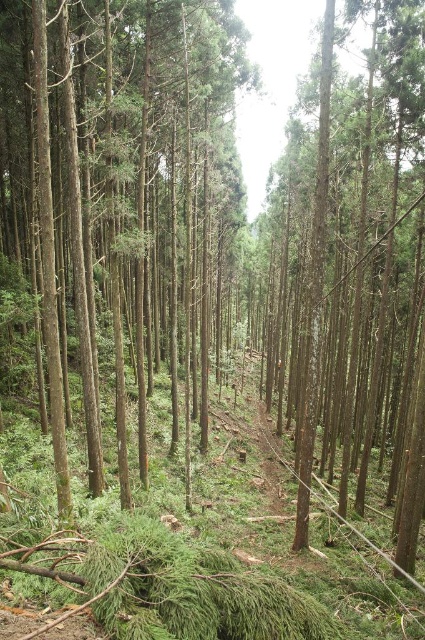
You are a hiker carrying a 20 feet long ladder. You want to place the ladder between the green smooth tree at center and the smooth brown tree trunk at center. Can the ladder fit between them?

The distance between the green smooth tree at center and the smooth brown tree trunk at center is 22.18 feet. Since the ladder is 20 feet long, it can fit between them as the distance is greater than the ladder length.

You are a hiker standing at the camera position. You see the green smooth tree at center. If you want to reach it, how many steps would you need to take if each step is about 2.5 feet long?

The green smooth tree at center is 25.25 feet away from the camera. Since each step is approximately 2.5 feet, dividing 25.25 by 2.5 gives approximately 10.1 steps. Therefore, you would need to take around 10 steps to reach the green smooth tree at center.

You are a hiker standing on the narrow dirt path at center. You notice two trees ahead of you. One is the green smooth tree at center and the other is the smooth brown tree trunk at center. Which tree is taller?

The green smooth tree at center has a lesser height compared to the smooth brown tree trunk at center, so the smooth brown tree trunk at center is taller.